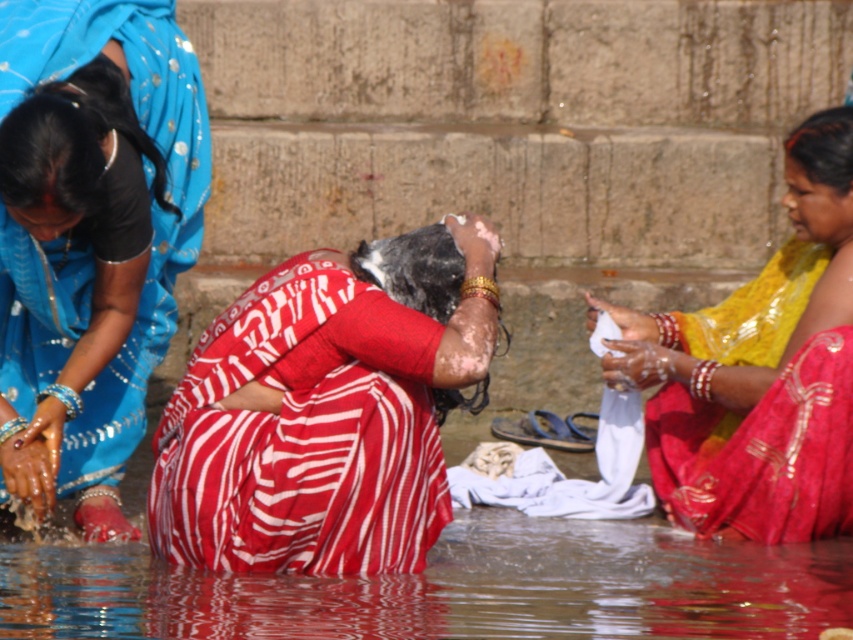
Is matte red sari at center below yellow satin saree at right?

Actually, matte red sari at center is above yellow satin saree at right.

Is point (131, 241) positioned after point (622, 316)?

No, (131, 241) is closer to viewer.

Which is in front, point (94, 29) or point (749, 339)?

Positioned in front is point (94, 29).

Locate an element on the screen. The height and width of the screenshot is (640, 853). matte red sari at center is located at coordinates [90, 237].

How much distance is there between red striped saree at center and clear water at lower center?

A distance of 31.98 inches exists between red striped saree at center and clear water at lower center.

Between red striped saree at center and clear water at lower center, which one has less height?

Standing shorter between the two is clear water at lower center.

Does point (438, 449) lie in front of point (612, 531)?

That is True.

Find the location of `red striped saree at center`. red striped saree at center is located at coordinates (325, 410).

Which is more to the right, matte red sari at center or clear water at lower center?

clear water at lower center is more to the right.

I want to click on matte red sari at center, so click(90, 237).